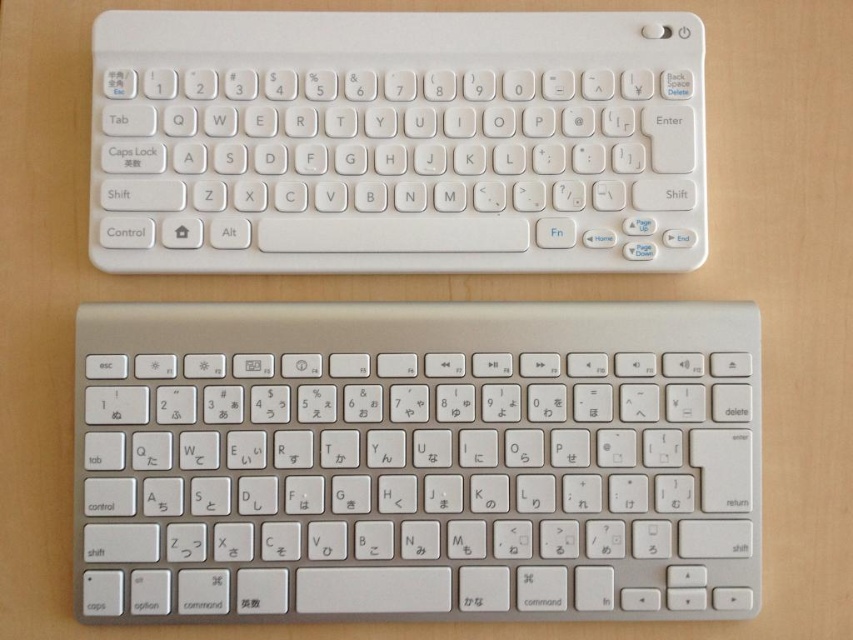
Question: Can you confirm if satin silver keyboard at center is thinner than white plastic keyboard at upper center?

Choices:
 (A) no
 (B) yes

Answer: (A)

Question: Does satin silver keyboard at center come behind white plastic keyboard at upper center?

Choices:
 (A) no
 (B) yes

Answer: (A)

Question: Which of the following is the farthest from the observer?

Choices:
 (A) (300, 186)
 (B) (680, 452)

Answer: (A)

Question: Which point appears closest to the camera in this image?

Choices:
 (A) (378, 218)
 (B) (647, 394)

Answer: (B)

Question: Can you confirm if satin silver keyboard at center is bigger than white plastic keyboard at upper center?

Choices:
 (A) yes
 (B) no

Answer: (A)

Question: Which point appears closest to the camera in this image?

Choices:
 (A) (656, 564)
 (B) (642, 16)

Answer: (A)